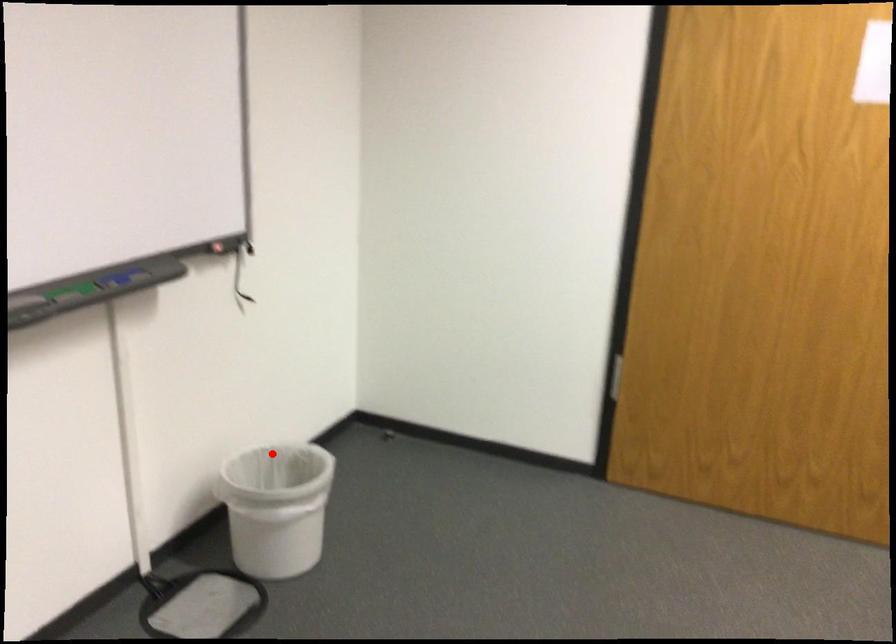
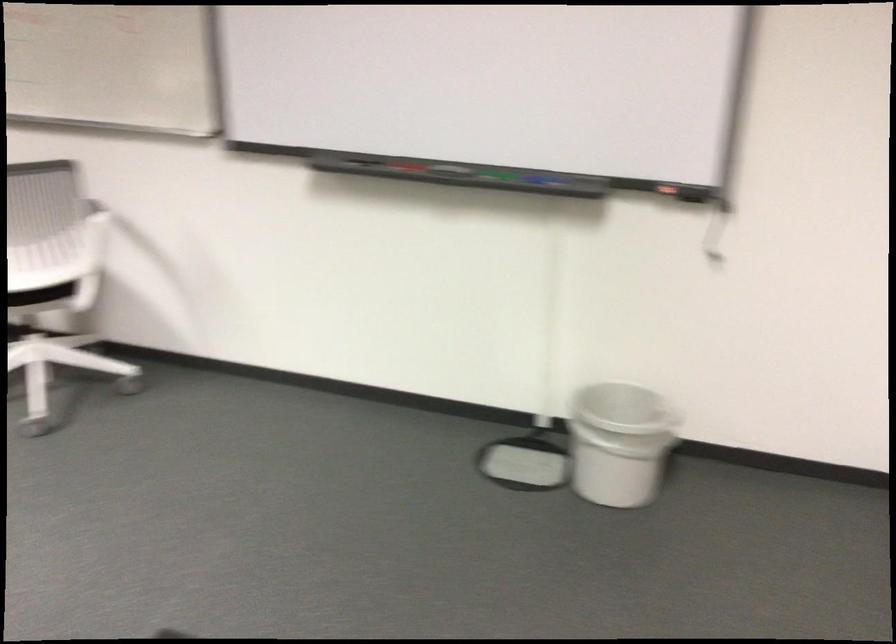
In the second image, find the point that corresponds to the highlighted location in the first image.

(618, 442)